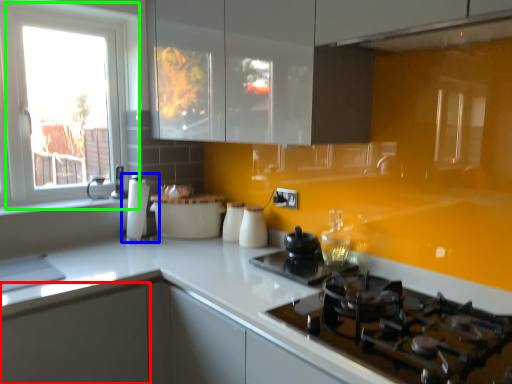
Question: Estimate the real-world distances between objects in this image. Which object is farther from cabinetry (highlighted by a red box), coffee machine (highlighted by a blue box) or window (highlighted by a green box)?

Choices:
 (A) coffee machine
 (B) window

Answer: (B)